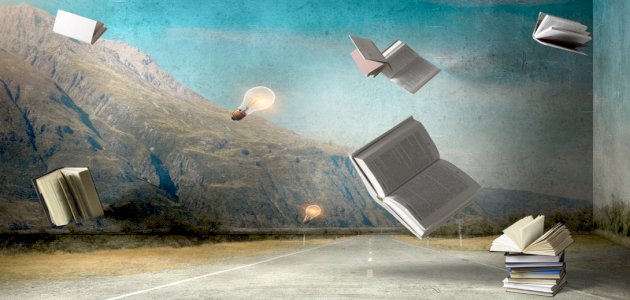
At what (x,y) coordinates should I click in order to perform the action: click on books. Please return your answer as a coordinate pair (x, y). Looking at the image, I should click on (76, 206), (415, 164), (75, 30), (410, 74), (369, 63), (575, 32), (534, 242), (530, 259), (552, 273), (542, 291).